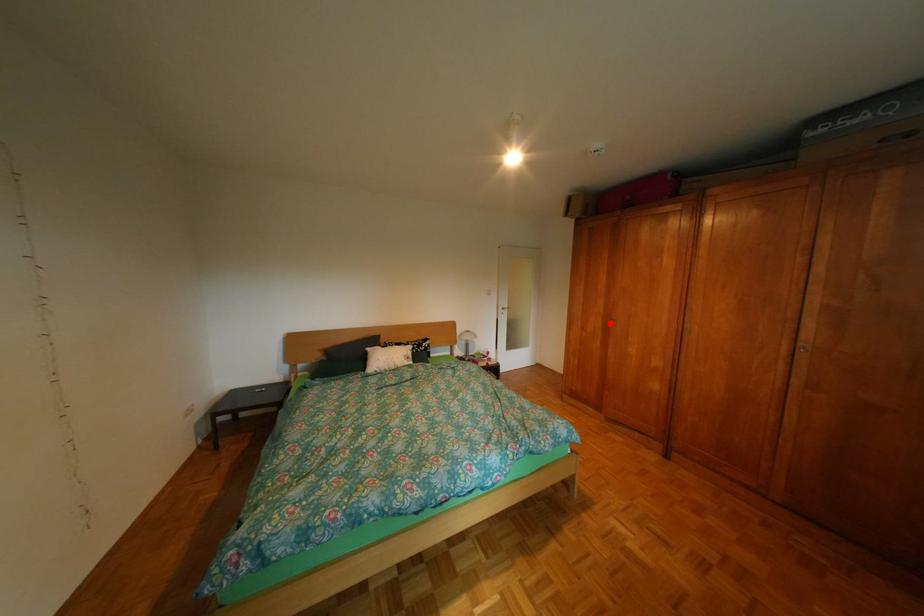
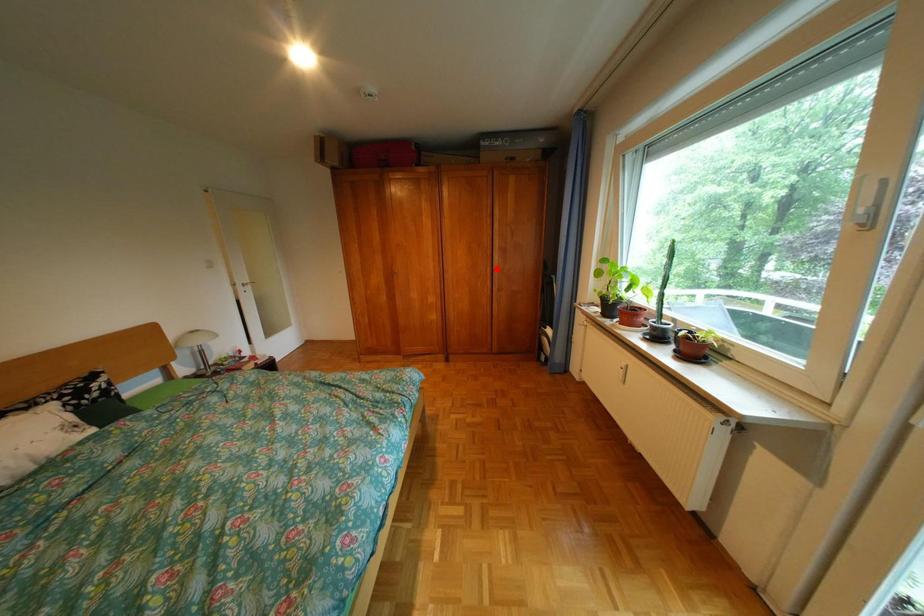
I am providing you with two images of the same scene from different viewpoints. A red point is marked on the first image and another point is marked on the second image. Is the marked point in image1 the same physical position as the marked point in image2?

No